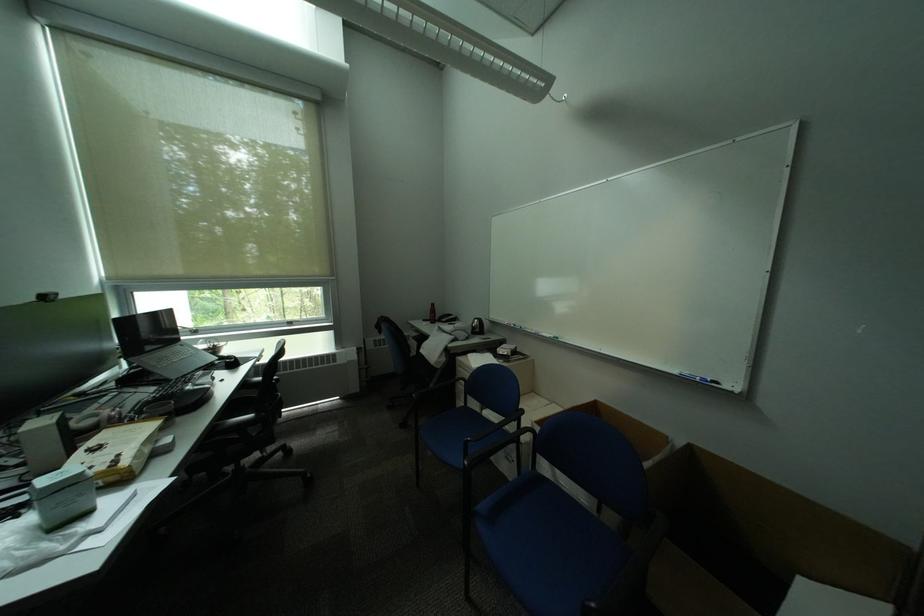
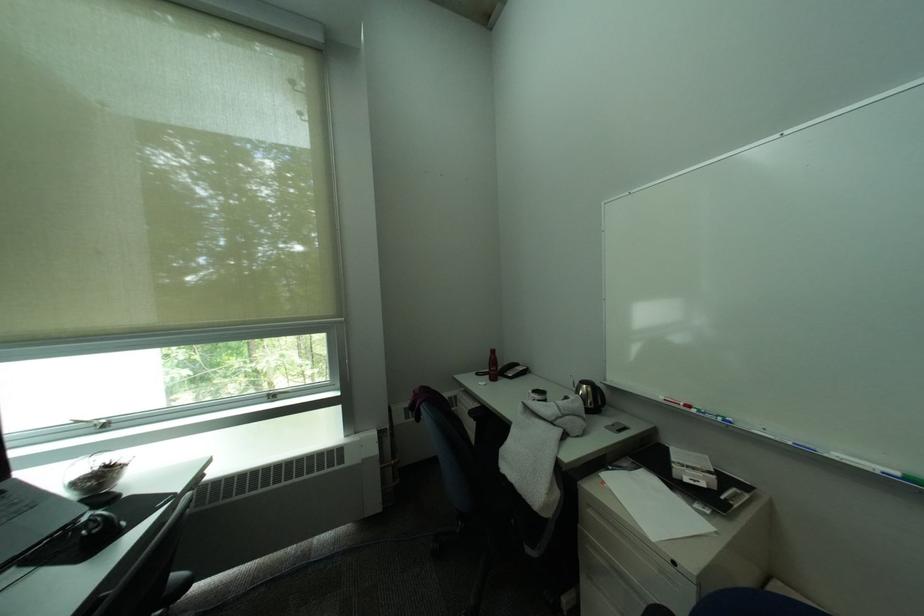
In the second image, find the point that corresponds to point (213, 352) in the first image.

(84, 485)